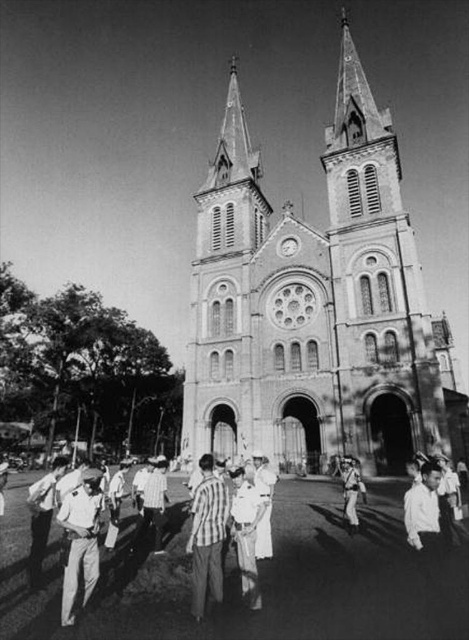
You are a photographer standing in front of the church and notice two items at the lower left corner of your viewfinder. You want to capture a closeup of the light brown fabric pants at lower left and the light brown leather jacket at lower left. Which item has a narrower width when viewed from your current position?

The light brown fabric pants at lower left is thinner than the light brown leather jacket at lower left, so the light brown fabric pants at lower left has a narrower width.

You are standing in front of the stone church at center and want to take a photo of the light brown leather jacket at lower left. Which object should you focus on first to ensure both are in frame?

The stone church at center is taller than the light brown leather jacket at lower left, so you should focus on the stone church at center first to ensure both are in frame.

You are a photographer aiming to capture a portrait of the two people wearing light brown fabric pants at lower left and light brown leather jacket at lower left. Since you want to emphasize their clothing, which clothing item should you focus on to ensure it appears taller in the photo?

The light brown leather jacket at lower left is taller than the light brown fabric pants at lower left, so focusing on the light brown leather jacket at lower left would make it appear taller in the photo.